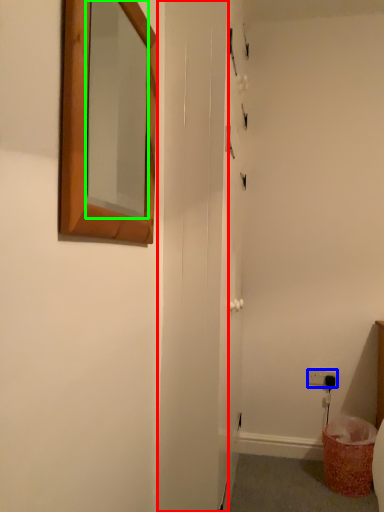
Question: Considering the real-world distances, which object is closest to screen door (highlighted by a red box)? electric outlet (highlighted by a blue box) or mirror (highlighted by a green box).

Choices:
 (A) electric outlet
 (B) mirror

Answer: (B)